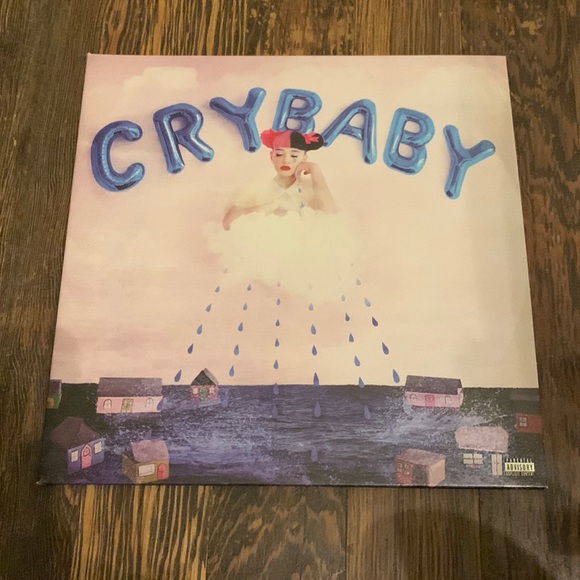
This screenshot has width=580, height=580. Identify the location of table. (282, 564), (290, 44).